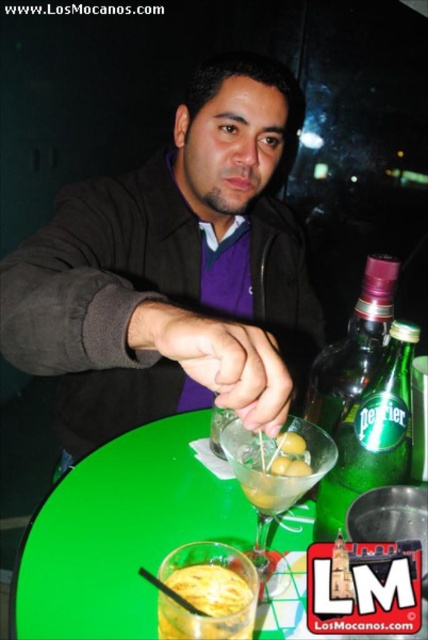
You are a customer sitting at the green plastic table at center and want to reach for the martini glass with olives. Considering the position of the matte black jacket at center, can you easily access the martini glass?

The matte black jacket at center is closer to the viewer than the green plastic table at center, so the jacket is blocking the direct path to the martini glass, making it difficult to access without moving the jacket.

You are a bartender who needs to reach for the transparent glass martini at center while standing behind the matte black jacket at center. Can you comfortably reach the martini without moving your position?

The distance between the matte black jacket at center and the transparent glass martini at center is 14.64 inches, which is within a comfortable reaching distance for most people, so yes, you can comfortably reach the martini without moving your position.

You are a customer at the bar and want to place your phone on the table. However, you notice the matte black jacket at center and the green plastic table at center. Which item is on top of the other?

The matte black jacket at center is positioned over green plastic table at center, so the matte black jacket at center is on top of the green plastic table at center.